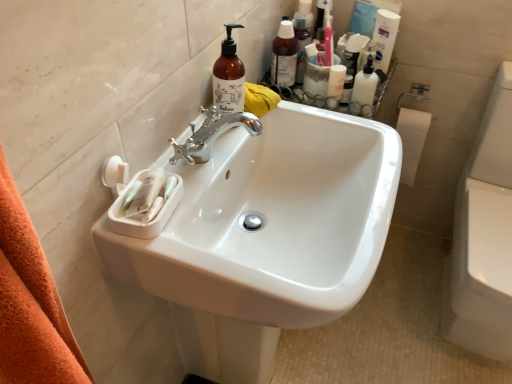
Where is `free space to the left of white glossy toilet bowl at right`? The image size is (512, 384). free space to the left of white glossy toilet bowl at right is located at coordinates (394, 312).